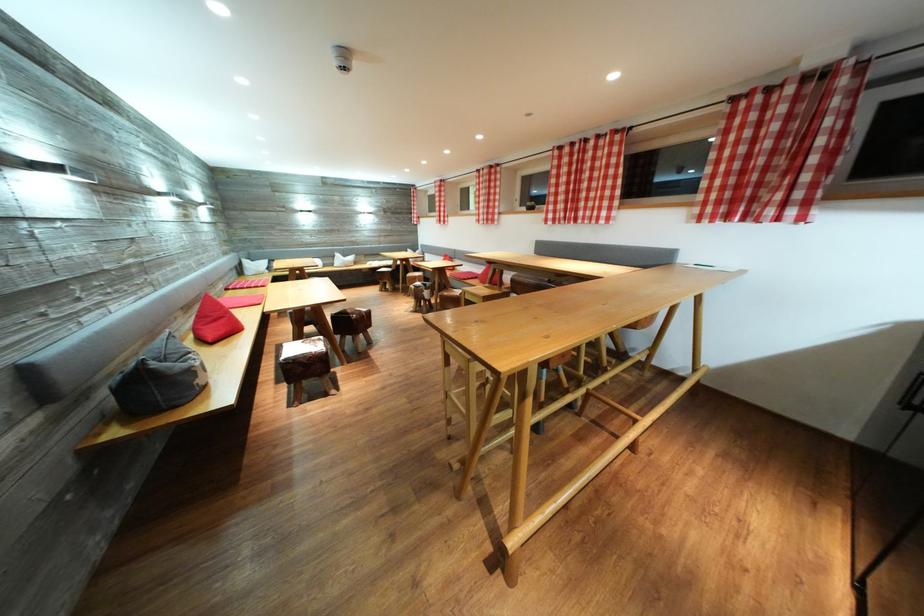
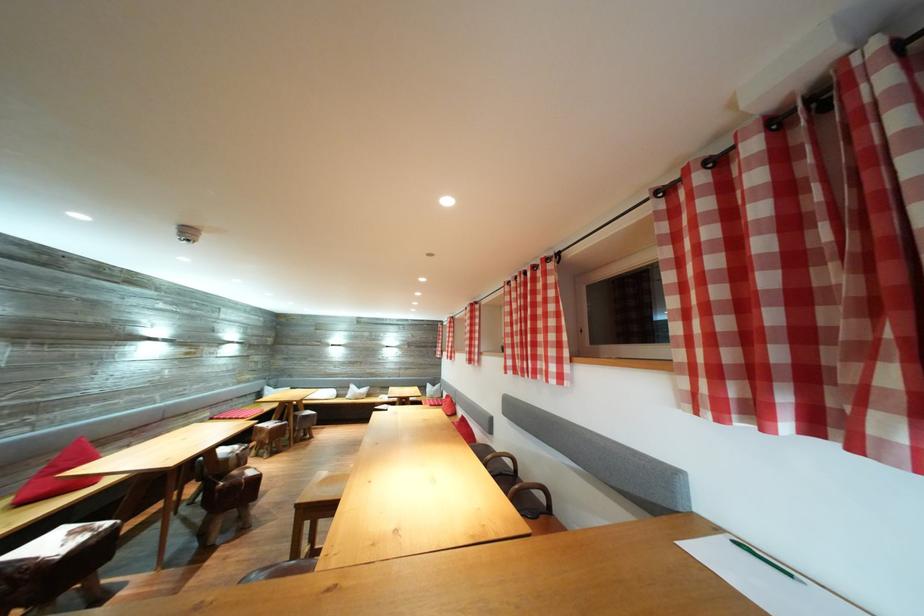
Where in the second image is the point corresponding to point (811, 84) from the first image?

(784, 127)